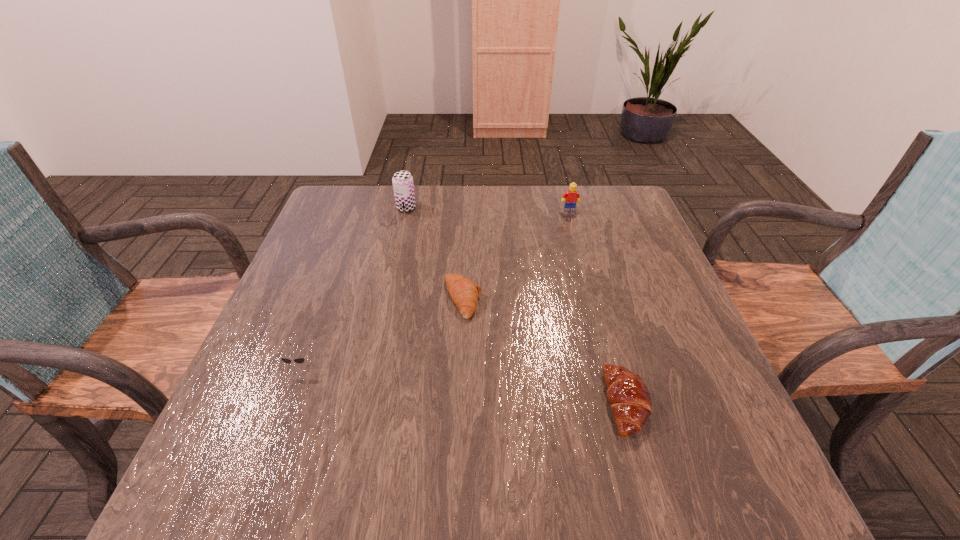
The image size is (960, 540). In order to click on beer can in this screenshot , I will do `click(403, 186)`.

Where is `the tallest object`? Image resolution: width=960 pixels, height=540 pixels. the tallest object is located at coordinates coord(403,186).

At what (x,y) coordinates should I click in order to perform the action: click on Lego. Please return your answer as a coordinate pair (x, y). Looking at the image, I should click on (572, 196).

Identify the location of sunglasses. The width and height of the screenshot is (960, 540). (298, 360).

Identify the location of the right crescent roll. (628, 395).

Locate an element on the screen. the left crescent roll is located at coordinates (463, 291).

The height and width of the screenshot is (540, 960). I want to click on the third object from left to right, so click(x=463, y=291).

Where is `free space located on the front of the beer can`? This screenshot has height=540, width=960. free space located on the front of the beer can is located at coordinates (391, 279).

Where is `free region located 0.080m on the front-facing side of the Lego`? This screenshot has height=540, width=960. free region located 0.080m on the front-facing side of the Lego is located at coordinates (574, 228).

Where is `vacant space located 0.200m in front of the lenses of the sunglasses`? This screenshot has height=540, width=960. vacant space located 0.200m in front of the lenses of the sunglasses is located at coordinates [259, 478].